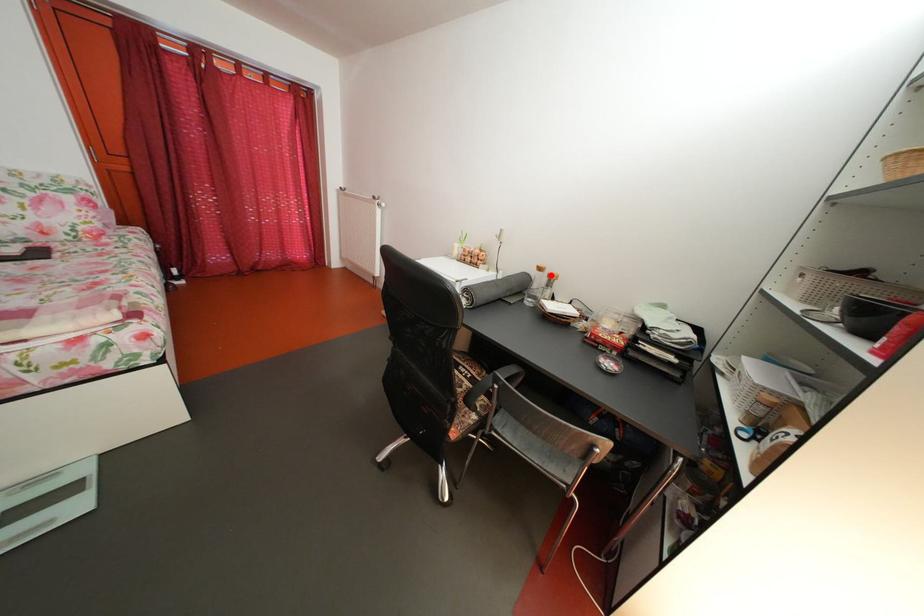
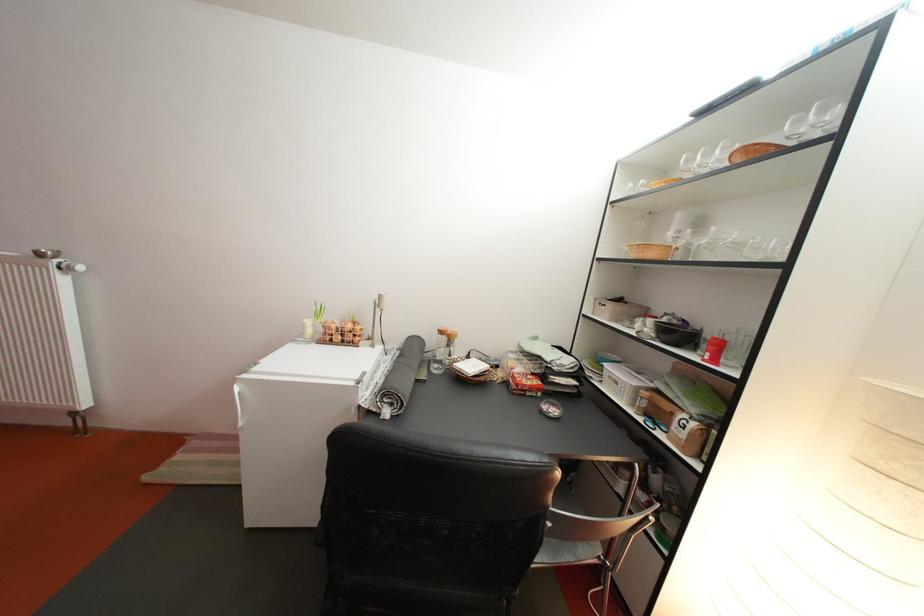
Question: I am providing you with two images of the same scene from different viewpoints. In image1, a red point is highlighted. Considering the same 3D point in image2, which of the following is correct?

Choices:
 (A) It is closer
 (B) It is farther

Answer: (B)